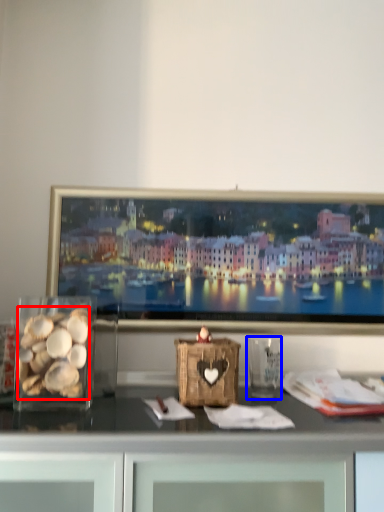
Question: Among these objects, which one is nearest to the camera, food (highlighted by a red box) or glass vase (highlighted by a blue box)?

Choices:
 (A) food
 (B) glass vase

Answer: (A)